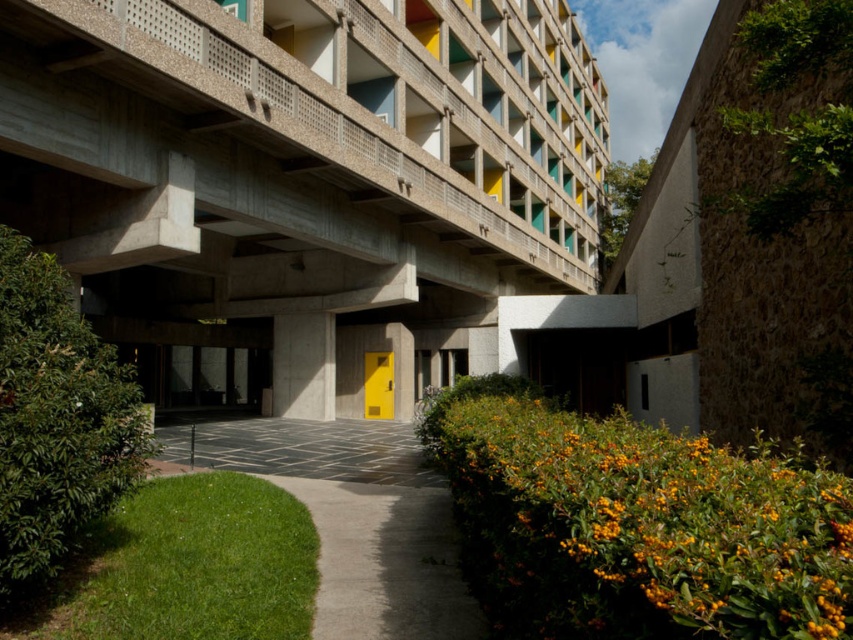
Question: In this image, where is smooth concrete path at center located relative to concrete pillar at center?

Choices:
 (A) left
 (B) right

Answer: (B)

Question: Among these objects, which one is farthest from the camera?

Choices:
 (A) smooth concrete path at center
 (B) concrete pillar at center

Answer: (B)

Question: Can you confirm if concrete at upper center is positioned to the right of smooth concrete path at center?

Choices:
 (A) yes
 (B) no

Answer: (A)

Question: Among these objects, which one is nearest to the camera?

Choices:
 (A) smooth concrete path at center
 (B) concrete at upper center

Answer: (A)

Question: Does concrete at upper center appear under smooth concrete path at center?

Choices:
 (A) yes
 (B) no

Answer: (B)

Question: Among these objects, which one is farthest from the camera?

Choices:
 (A) concrete pillar at center
 (B) smooth concrete path at center
 (C) concrete at upper center

Answer: (A)